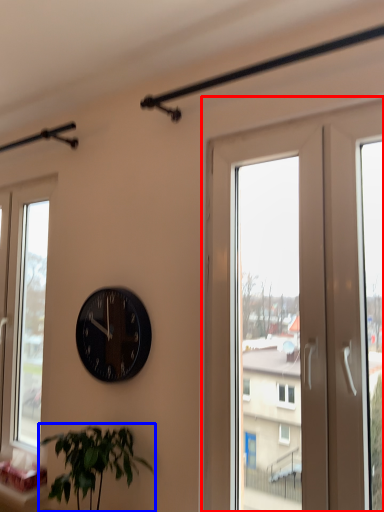
Question: Which object is further to the camera taking this photo, screen door (highlighted by a red box) or houseplant (highlighted by a blue box)?

Choices:
 (A) screen door
 (B) houseplant

Answer: (B)